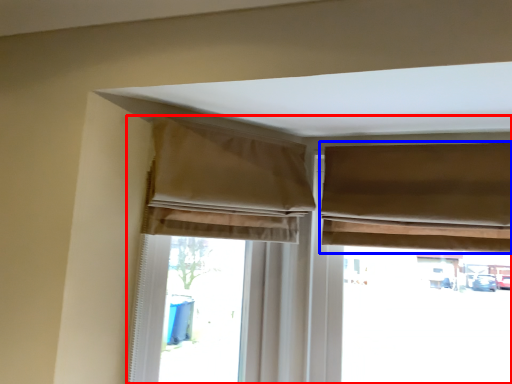
Question: Which of the following is the closest to the observer, window (highlighted by a red box) or curtain (highlighted by a blue box)?

Choices:
 (A) window
 (B) curtain

Answer: (B)